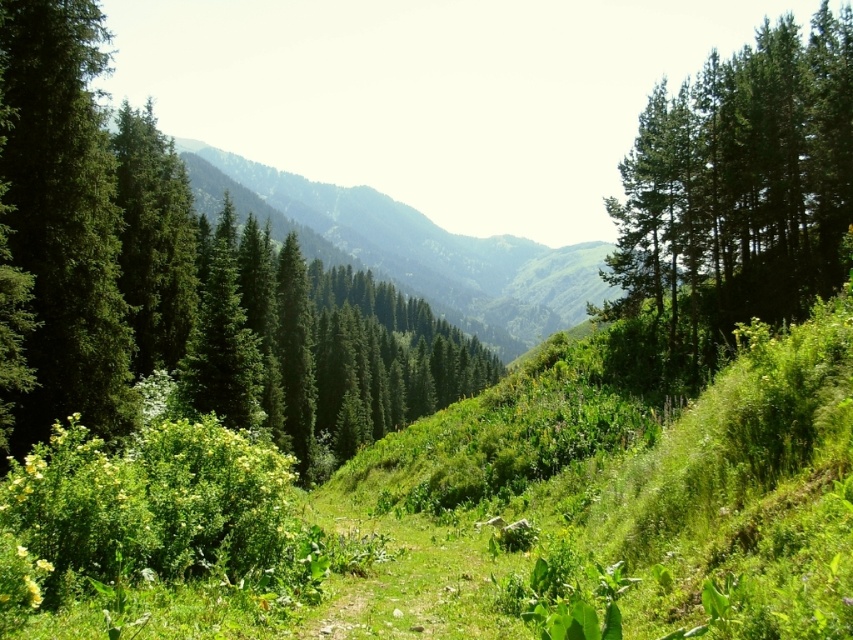
You are hiking along the narrow dirt path in the mountain landscape and see two green matte trees. One is at the upper right and the other at the left. From your perspective on the path, which direction is the green matte tree at upper right relative to the green matte tree at left?

The green matte tree at upper right is located to the right of the green matte tree at left.

You are a hiker planning to walk along the narrow dirt path in the foreground. You want to know if the green matte tree at left is wider than the green textured mountain at center. Based on the scene, can you determine this?

The green matte tree at left has a lesser width compared to the green textured mountain at center, so the tree is not wider than the mountain.

You are a hiker standing at the start of the dirt path in the foreground. You notice two green matte trees in the scene. Which tree has a wider base, the green matte tree at upper right or the green matte tree at left?

The green matte tree at upper right has a wider base than the green matte tree at left because its width surpasses the latter.